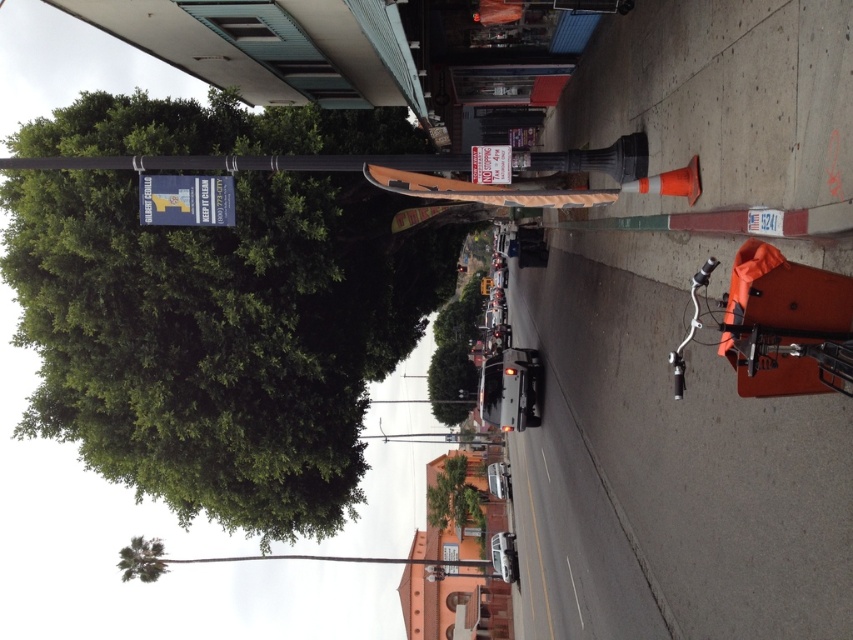
Can you confirm if green leafy tree at upper left is positioned to the right of green leafy tree at center?

Incorrect, green leafy tree at upper left is not on the right side of green leafy tree at center.

Is green leafy tree at upper left positioned at the back of green leafy tree at center?

No, green leafy tree at upper left is in front of green leafy tree at center.

Is point (15, 266) behind point (480, 513)?

No, it is in front of (480, 513).

Identify the location of green leafy tree at upper left. The height and width of the screenshot is (640, 853). (219, 337).

Between green leafy tree at center and green leafy tree at lower left, which one is positioned higher?

Positioned higher is green leafy tree at center.

Which is in front, point (479, 512) or point (128, 556)?

Point (128, 556)

Image resolution: width=853 pixels, height=640 pixels. Find the location of `green leafy tree at center`. green leafy tree at center is located at coordinates 454,497.

Does green leafy tree at upper left come in front of green leafy tree at lower left?

Yes, it is in front of green leafy tree at lower left.

What do you see at coordinates (219, 337) in the screenshot? Image resolution: width=853 pixels, height=640 pixels. I see `green leafy tree at upper left` at bounding box center [219, 337].

This screenshot has width=853, height=640. What are the coordinates of `green leafy tree at upper left` in the screenshot? It's located at (219, 337).